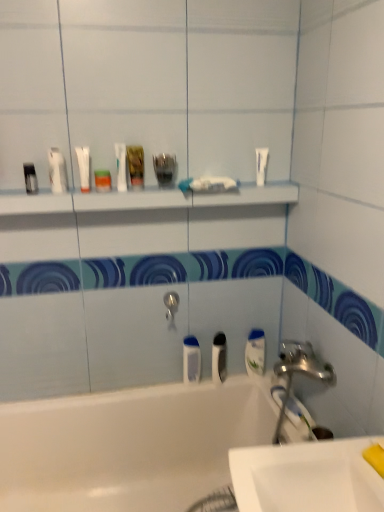
Question: Is white glossy shelf at upper center positioned with its back to matte black container at upper left, acting as the 3th toiletry starting from the right?

Choices:
 (A) yes
 (B) no

Answer: (B)

Question: Could you tell me if white glossy shelf at upper center is turned towards matte black container at upper left, acting as the 3th toiletry starting from the right?

Choices:
 (A) no
 (B) yes

Answer: (A)

Question: Does white glossy shelf at upper center appear on the left side of matte black container at upper left, acting as the 3th toiletry starting from the right?

Choices:
 (A) no
 (B) yes

Answer: (A)

Question: Can you confirm if white glossy shelf at upper center is shorter than matte black container at upper left, marked as the first toiletry in a left-to-right arrangement?

Choices:
 (A) yes
 (B) no

Answer: (A)

Question: Does white glossy shelf at upper center appear on the right side of matte black container at upper left, marked as the first toiletry in a left-to-right arrangement?

Choices:
 (A) no
 (B) yes

Answer: (B)

Question: Considering the relative sizes of white glossy shelf at upper center and matte black container at upper left, acting as the 3th toiletry starting from the right, in the image provided, is white glossy shelf at upper center bigger than matte black container at upper left, acting as the 3th toiletry starting from the right,?

Choices:
 (A) yes
 (B) no

Answer: (A)

Question: Can you confirm if white matte toothpaste at center, the second toothpaste from the right, is positioned to the left of white glossy tube at upper center, arranged as the first mouthwash when viewed from the left?

Choices:
 (A) yes
 (B) no

Answer: (B)

Question: Considering the relative sizes of white matte toothpaste at center, the second toothpaste from the right, and white glossy tube at upper center, arranged as the 5th mouthwash when viewed from the right, in the image provided, is white matte toothpaste at center, the second toothpaste from the right, smaller than white glossy tube at upper center, arranged as the 5th mouthwash when viewed from the right,?

Choices:
 (A) yes
 (B) no

Answer: (B)

Question: Could you tell me if white matte toothpaste at center, the second toothpaste from the right, is facing white glossy tube at upper center, which is counted as the fourth mouthwash, starting from the bottom?

Choices:
 (A) yes
 (B) no

Answer: (B)

Question: Considering the relative sizes of white matte toothpaste at center, which ranks as the 1th toothpaste in left-to-right order, and white glossy tube at upper center, acting as the 2th mouthwash starting from the top, in the image provided, is white matte toothpaste at center, which ranks as the 1th toothpaste in left-to-right order, taller than white glossy tube at upper center, acting as the 2th mouthwash starting from the top,?

Choices:
 (A) no
 (B) yes

Answer: (A)

Question: From the image's perspective, is white matte toothpaste at center, which ranks as the 1th toothpaste in left-to-right order, located above white glossy tube at upper center, arranged as the first mouthwash when viewed from the left?

Choices:
 (A) no
 (B) yes

Answer: (A)

Question: From the image's perspective, is white matte toothpaste at center, the second toothpaste from the right, beneath white glossy tube at upper center, arranged as the first mouthwash when viewed from the left?

Choices:
 (A) no
 (B) yes

Answer: (B)

Question: From a real-world perspective, is white glossy sink at lower right below white glossy bathtub at lower left?

Choices:
 (A) no
 (B) yes

Answer: (A)